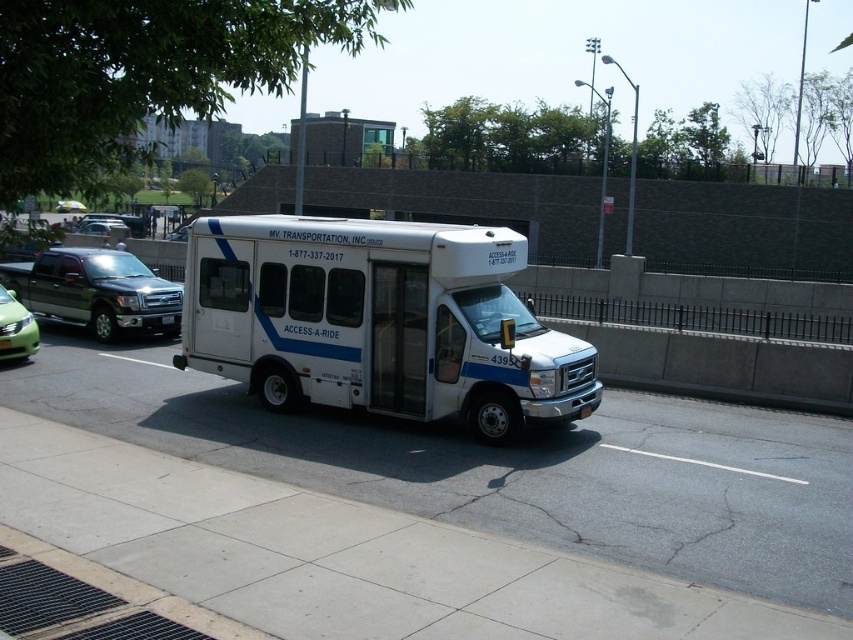
Question: Does white matte van at center have a greater width compared to green glossy sedan at left?

Choices:
 (A) yes
 (B) no

Answer: (A)

Question: Based on their relative distances, which object is farther from the white matte van at center?

Choices:
 (A) metallic gray truck at left
 (B) gray concrete pavement at center

Answer: (A)

Question: Is white matte van at center above metallic gray truck at left?

Choices:
 (A) yes
 (B) no

Answer: (B)

Question: Is gray concrete pavement at center above green matte car at center?

Choices:
 (A) yes
 (B) no

Answer: (B)

Question: Which of these objects is positioned closest to the gray concrete pavement at center?

Choices:
 (A) green glossy sedan at left
 (B) green matte car at center

Answer: (A)

Question: Which object is closer to the camera taking this photo?

Choices:
 (A) metallic gray truck at left
 (B) green glossy sedan at left
 (C) gray concrete pavement at center
 (D) white matte van at center

Answer: (C)